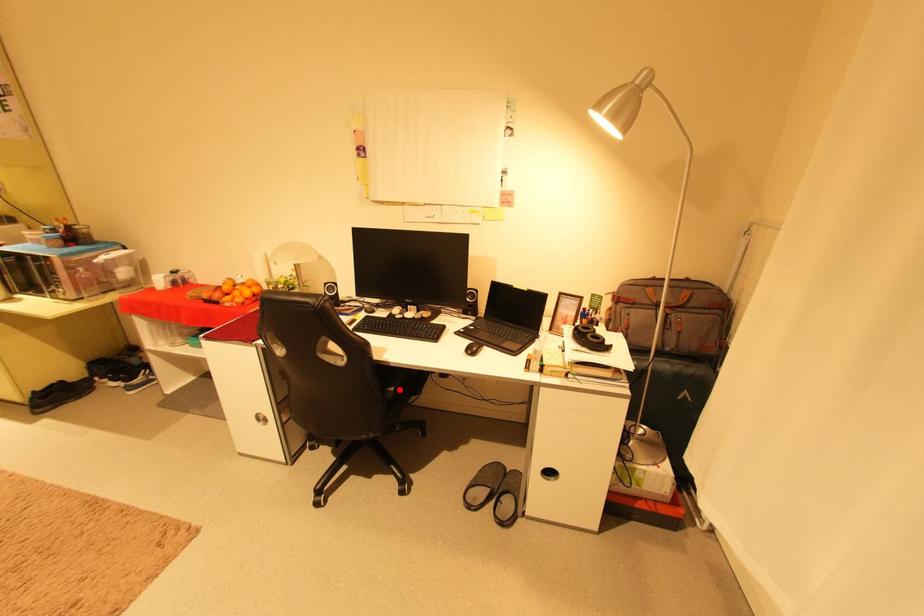
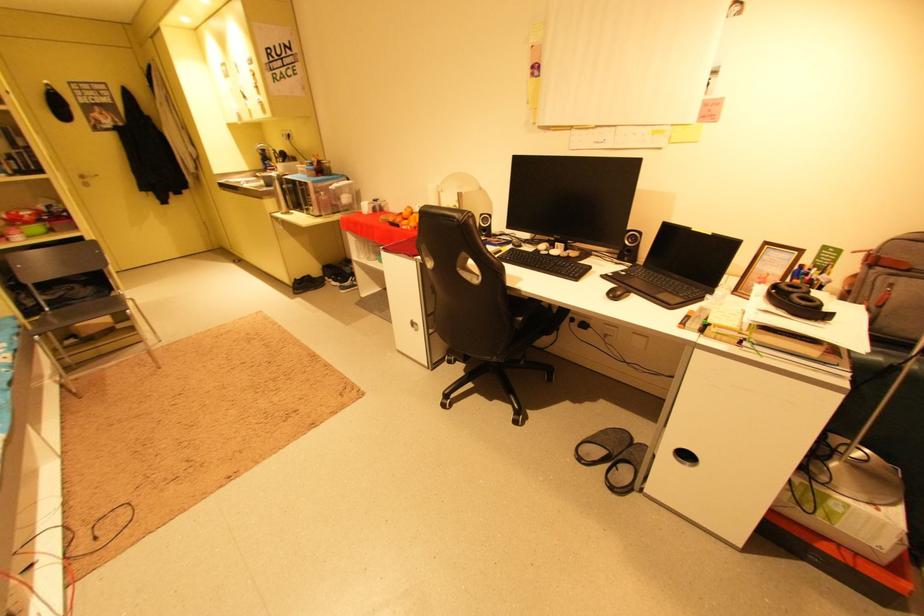
The point at the highlighted location is marked in the first image. Where is the corresponding point in the second image?

(529, 320)